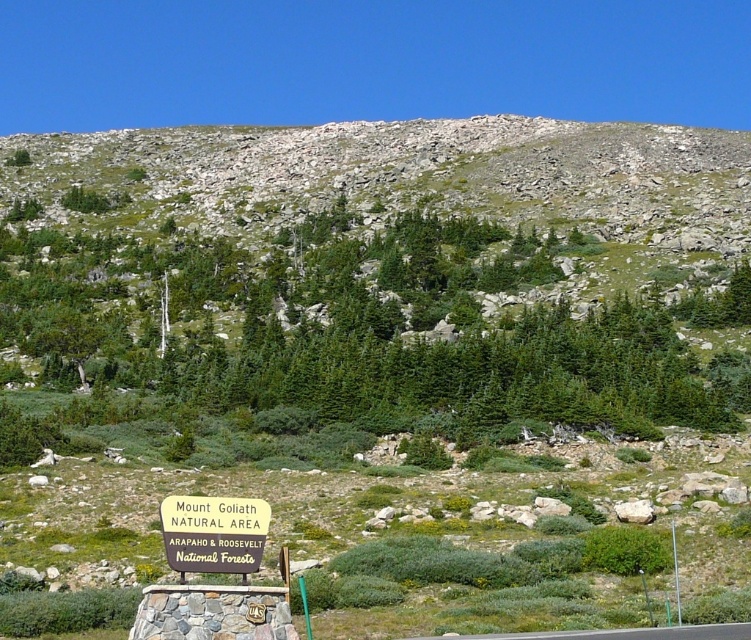
Question: Which object is closer to the camera taking this photo?

Choices:
 (A) green evergreen tree at center
 (B) green grassy hillside at upper center

Answer: (A)

Question: Is green evergreen tree at center thinner than green grassy hillside at upper center?

Choices:
 (A) no
 (B) yes

Answer: (B)

Question: Can you confirm if green grassy hillside at upper center is wider than yellow wood sign at lower center?

Choices:
 (A) no
 (B) yes

Answer: (B)

Question: Which point is farther from the camera taking this photo?

Choices:
 (A) (623, 396)
 (B) (249, 506)

Answer: (A)

Question: Which point is farther to the camera?

Choices:
 (A) green evergreen tree at center
 (B) yellow wood sign at lower center
 (C) green grassy hillside at upper center

Answer: (C)

Question: Is green evergreen tree at center below green grassy hillside at upper center?

Choices:
 (A) yes
 (B) no

Answer: (A)